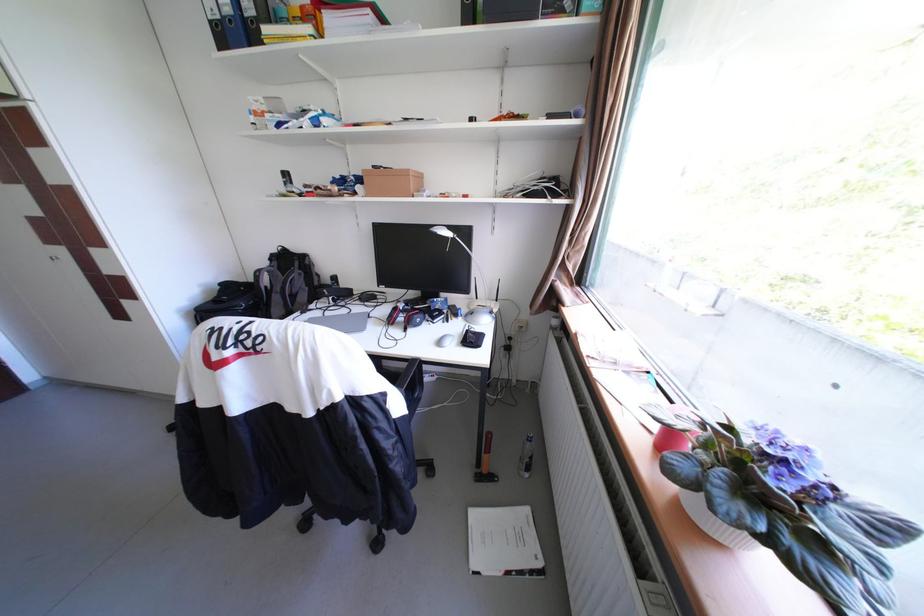
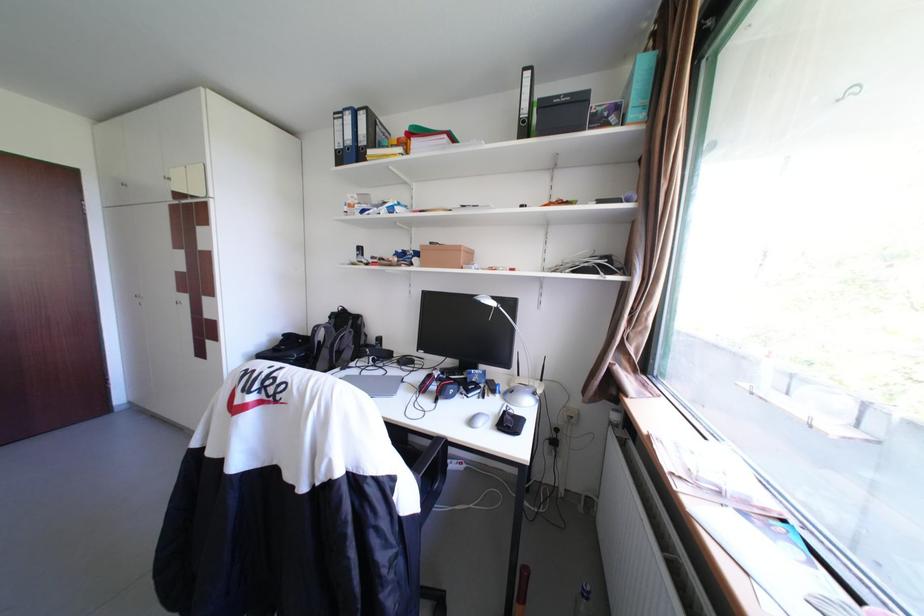
Where in the second image is the point corresponding to [234,36] from the first image?

(351, 158)